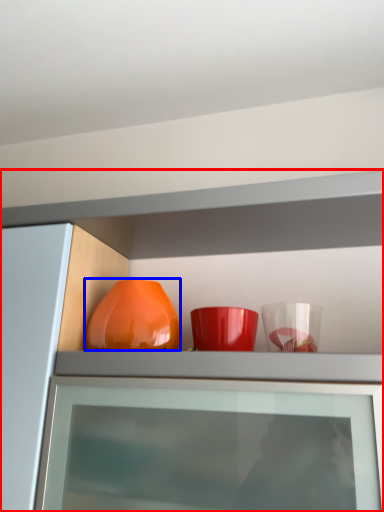
Question: Which point is further to the camera, cabinetry (highlighted by a red box) or vase (highlighted by a blue box)?

Choices:
 (A) cabinetry
 (B) vase

Answer: (B)